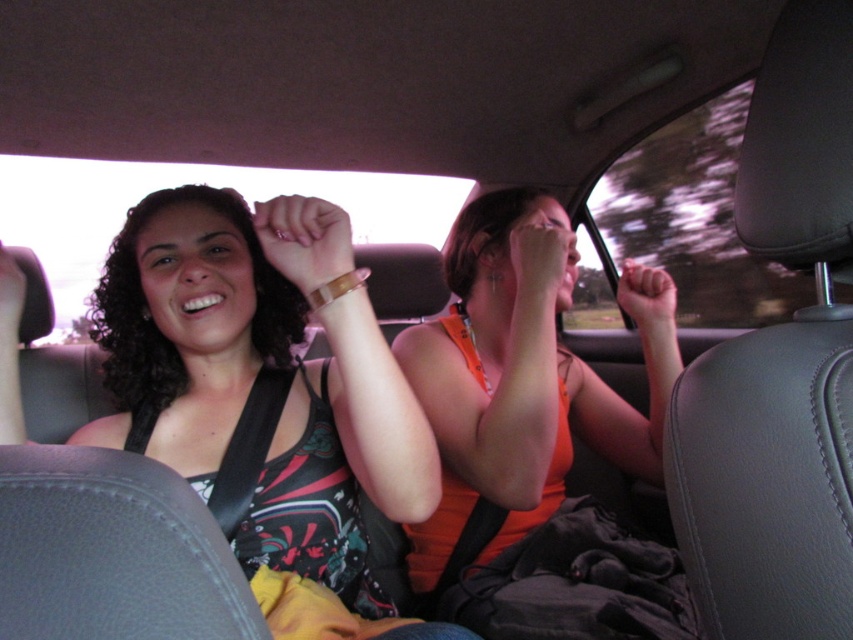
Is matte brown bracelet at center wider than matte orange hand at center?

Yes.

Is matte brown bracelet at center in front of matte orange hand at center?

Yes, matte brown bracelet at center is in front of matte orange hand at center.

Where is `matte brown bracelet at center`? matte brown bracelet at center is located at coordinates (305, 240).

You are a GUI agent. You are given a task and a screenshot of the screen. Output one action in this format:
    pyautogui.click(x=<x>, y=<y>)
    Task: Click on the matte brown bracelet at center
    Image resolution: width=853 pixels, height=640 pixels.
    Given the screenshot: What is the action you would take?
    pyautogui.click(x=305, y=240)

Is matte orange hand at center closer to camera compared to matte black hand at upper left?

No, matte orange hand at center is behind matte black hand at upper left.

Can you confirm if matte orange hand at center is shorter than matte black hand at upper left?

No, matte orange hand at center is not shorter than matte black hand at upper left.

The height and width of the screenshot is (640, 853). Describe the element at coordinates (646, 296) in the screenshot. I see `matte orange hand at center` at that location.

This screenshot has height=640, width=853. I want to click on matte orange hand at center, so click(646, 296).

Does orange fabric tank top at center appear on the right side of matte orange hand at center?

Incorrect, orange fabric tank top at center is not on the right side of matte orange hand at center.

Can you confirm if orange fabric tank top at center is wider than matte orange hand at center?

Yes, orange fabric tank top at center is wider than matte orange hand at center.

Is point (496, 506) closer to camera compared to point (651, 280)?

Yes, point (496, 506) is closer to viewer.

Locate an element on the screen. This screenshot has height=640, width=853. orange fabric tank top at center is located at coordinates (514, 385).